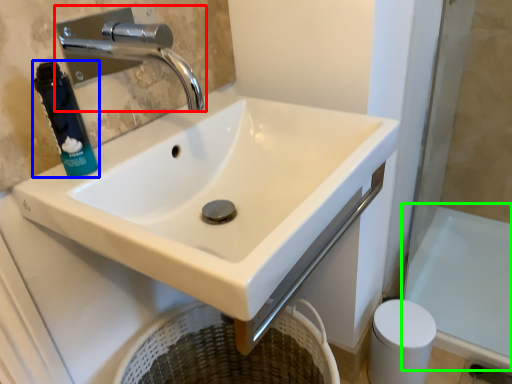
Question: Based on their relative distances, which object is farther from tap (highlighted by a red box)? Choose from mouthwash (highlighted by a blue box) and bath (highlighted by a green box).

Choices:
 (A) mouthwash
 (B) bath

Answer: (B)